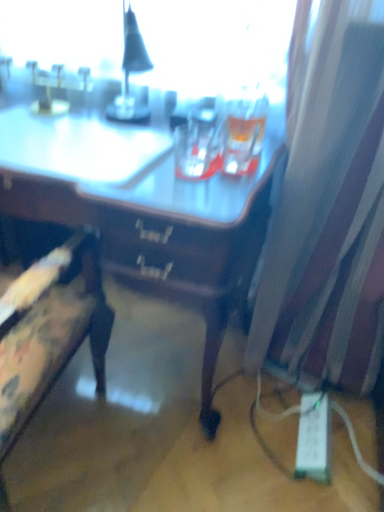
Question: From a real-world perspective, does white plastic extension cord at lower right stand above floral fabric chair at left?

Choices:
 (A) yes
 (B) no

Answer: (B)

Question: Is white plastic extension cord at lower right at the right side of floral fabric chair at left?

Choices:
 (A) yes
 (B) no

Answer: (A)

Question: Can you confirm if white plastic extension cord at lower right is smaller than floral fabric chair at left?

Choices:
 (A) yes
 (B) no

Answer: (A)

Question: Is white plastic extension cord at lower right next to floral fabric chair at left?

Choices:
 (A) no
 (B) yes

Answer: (A)

Question: Is white plastic extension cord at lower right turned away from floral fabric chair at left?

Choices:
 (A) no
 (B) yes

Answer: (A)

Question: From the image's perspective, is white sheer curtain at right positioned above or below white plastic extension cord at lower right?

Choices:
 (A) above
 (B) below

Answer: (A)

Question: Looking at their shapes, would you say white sheer curtain at right is wider or thinner than white plastic extension cord at lower right?

Choices:
 (A) wide
 (B) thin

Answer: (A)

Question: Visually, is white sheer curtain at right positioned to the left or to the right of white plastic extension cord at lower right?

Choices:
 (A) right
 (B) left

Answer: (A)

Question: Is white sheer curtain at right situated inside white plastic extension cord at lower right or outside?

Choices:
 (A) outside
 (B) inside

Answer: (A)

Question: From a real-world perspective, relative to wooden desk at center, is white sheer curtain at right vertically above or below?

Choices:
 (A) below
 (B) above

Answer: (B)

Question: Is white sheer curtain at right bigger or smaller than wooden desk at center?

Choices:
 (A) big
 (B) small

Answer: (B)

Question: In terms of width, does white sheer curtain at right look wider or thinner when compared to wooden desk at center?

Choices:
 (A) wide
 (B) thin

Answer: (B)

Question: From their relative heights in the image, would you say white sheer curtain at right is taller or shorter than wooden desk at center?

Choices:
 (A) short
 (B) tall

Answer: (B)

Question: From the image's perspective, is wooden desk at center positioned above or below floral fabric chair at left?

Choices:
 (A) above
 (B) below

Answer: (A)

Question: From a real-world perspective, relative to floral fabric chair at left, is wooden desk at center vertically above or below?

Choices:
 (A) above
 (B) below

Answer: (B)